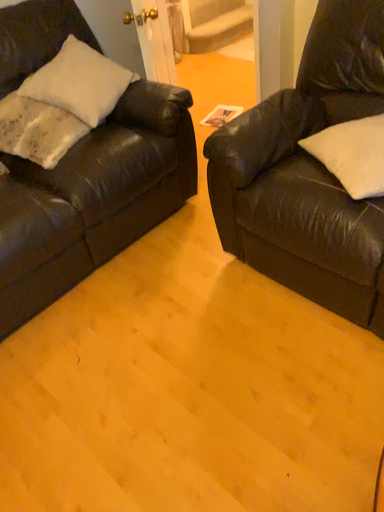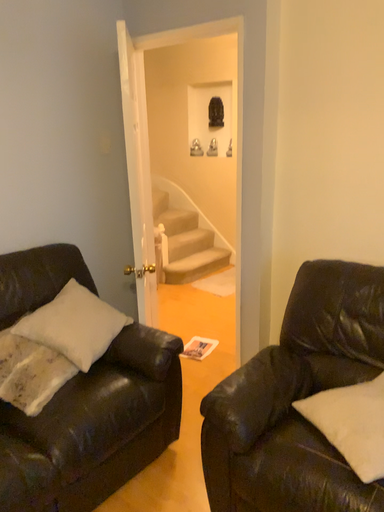
Question: Which way did the camera rotate in the video?

Choices:
 (A) rotated right
 (B) rotated left

Answer: (A)